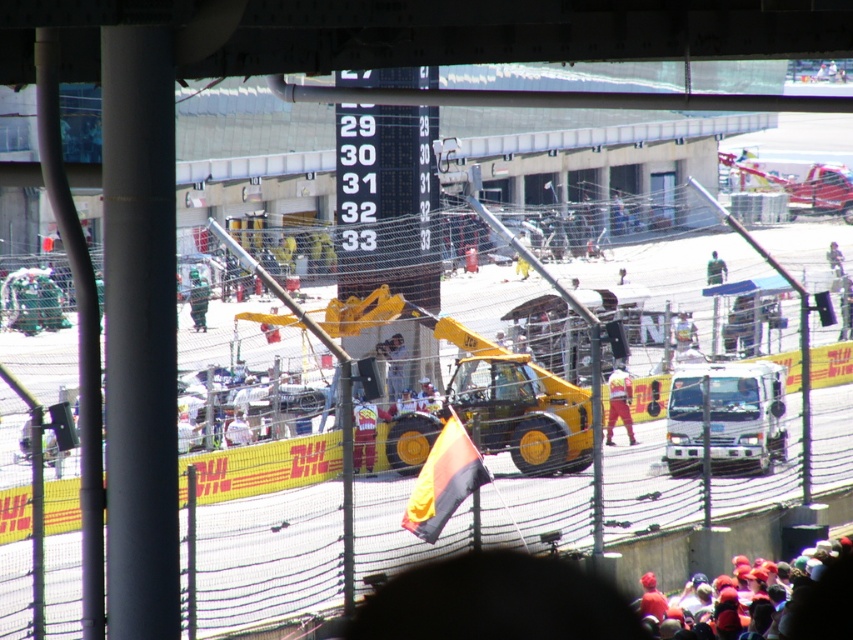
Question: Which object appears farthest from the camera in this image?

Choices:
 (A) green fabric person at center
 (B) white fabric shirt at center
 (C) dark blue uniform at upper right
 (D) yellow rubber boot at center

Answer: (C)

Question: Is red fabric crowd at lower right below yellow rubber boot at center?

Choices:
 (A) no
 (B) yes

Answer: (B)

Question: Does white fabric shirt at center lie in front of dark blue uniform at upper right?

Choices:
 (A) yes
 (B) no

Answer: (A)

Question: Which point appears closest to the camera in this image?

Choices:
 (A) (403, 362)
 (B) (796, 604)

Answer: (B)

Question: Can you confirm if white fabric person at center is smaller than white fabric shirt at center?

Choices:
 (A) no
 (B) yes

Answer: (A)

Question: Which object is closer to the camera taking this photo?

Choices:
 (A) green fabric person at center
 (B) yellow rubber boot at center
 (C) white fabric shirt at center

Answer: (C)